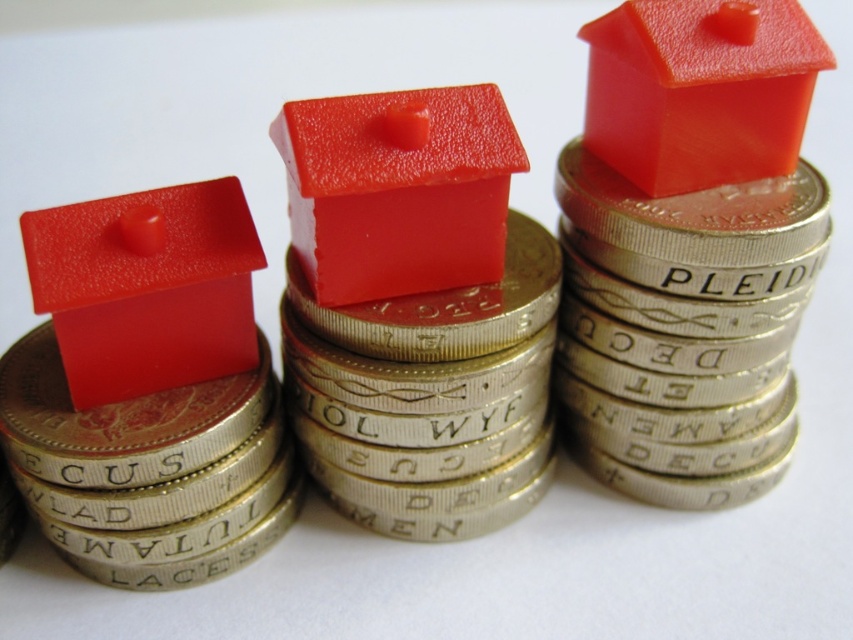
You are a collector who wants to display the matte plastic house at center and the matte gold coin at left in a showcase. Which object is thinner?

The matte plastic house at center is thinner than the matte gold coin at left according to the description.

You are standing 40 inches away from the matte plastic house at center. Can you reach it without moving closer?

The matte plastic house at center is 38.10 inches away from the viewer. Since you are standing 40 inches away, you are slightly farther than the distance required to reach it. You would need to move 1.9 inches closer to comfortably reach the matte plastic house at center.

You are a collector who wants to stack a new glossy plastic house at center on top of the matte gold coin at left. Based on the scene description, will the house fit on the coin without falling over?

The matte gold coin at left is thinner than the glossy plastic house at center. Since the coin is thinner, it may not provide enough surface area to support the house, so the house might not fit securely and could fall over.